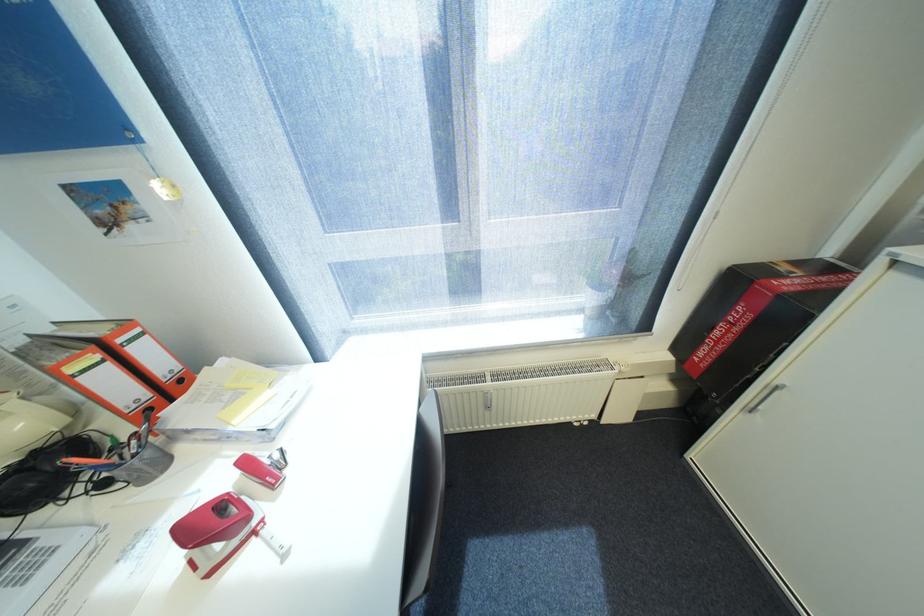
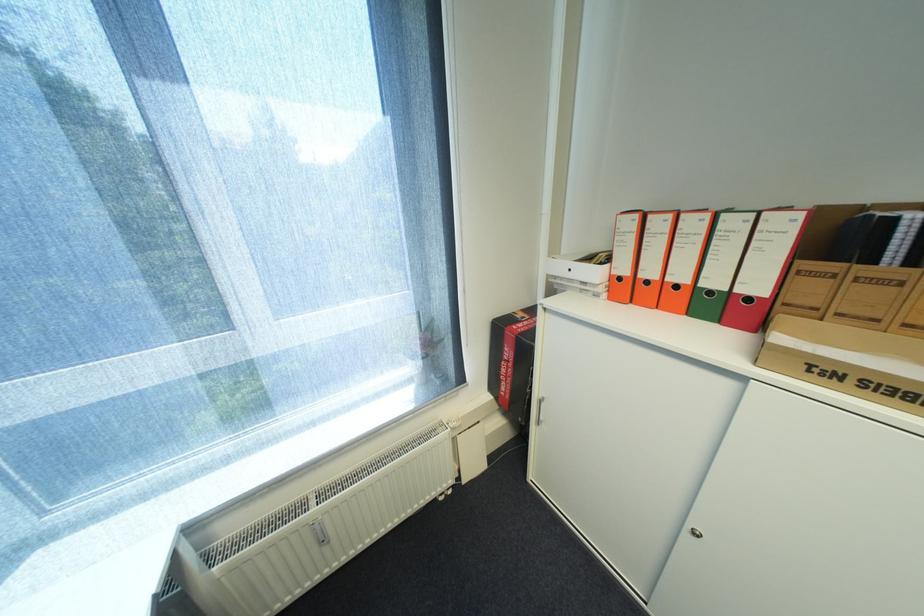
The point at (804, 274) is marked in the first image. Where is the corresponding point in the second image?

(532, 318)